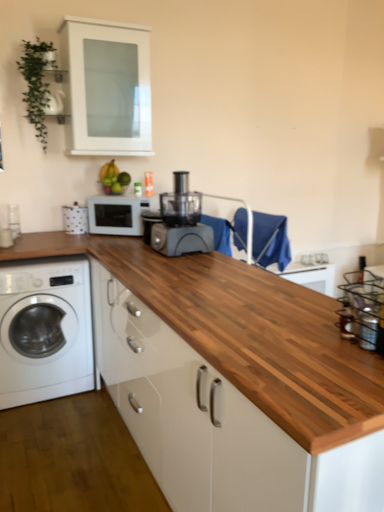
Question: Can you confirm if green matte bananas at upper center is wider than wooden at center?

Choices:
 (A) no
 (B) yes

Answer: (A)

Question: From a real-world perspective, is green matte bananas at upper center located higher than wooden at center?

Choices:
 (A) yes
 (B) no

Answer: (A)

Question: From a real-world perspective, is green matte bananas at upper center under wooden at center?

Choices:
 (A) no
 (B) yes

Answer: (A)

Question: Does green matte bananas at upper center turn towards wooden at center?

Choices:
 (A) no
 (B) yes

Answer: (A)

Question: Does green matte bananas at upper center have a larger size compared to wooden at center?

Choices:
 (A) yes
 (B) no

Answer: (B)

Question: Is green matte bananas at upper center at the left side of wooden at center?

Choices:
 (A) no
 (B) yes

Answer: (B)

Question: From the image's perspective, is matte black food processor at center below clear glass bottle at right?

Choices:
 (A) yes
 (B) no

Answer: (B)

Question: Considering the relative sizes of matte black food processor at center and clear glass bottle at right in the image provided, is matte black food processor at center smaller than clear glass bottle at right?

Choices:
 (A) yes
 (B) no

Answer: (B)

Question: Would you say matte black food processor at center is outside clear glass bottle at right?

Choices:
 (A) yes
 (B) no

Answer: (A)

Question: Is matte black food processor at center aimed at clear glass bottle at right?

Choices:
 (A) no
 (B) yes

Answer: (A)

Question: Can you confirm if matte black food processor at center is wider than clear glass bottle at right?

Choices:
 (A) no
 (B) yes

Answer: (B)

Question: From a real-world perspective, is matte black food processor at center physically below clear glass bottle at right?

Choices:
 (A) yes
 (B) no

Answer: (B)

Question: Does white matte cabinet at upper center have a lesser width compared to wooden at center?

Choices:
 (A) no
 (B) yes

Answer: (B)